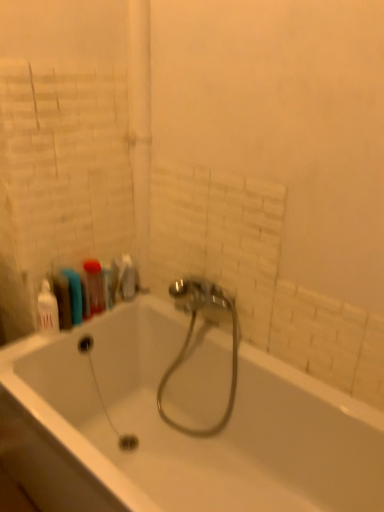
Question: Is white glossy bathtub at center at the left side of translucent plastic toothbrush at upper left, acting as the 2th toiletry starting from the front?

Choices:
 (A) no
 (B) yes

Answer: (A)

Question: Is white glossy bathtub at center far from translucent plastic toothbrush at upper left, which is the 1th toiletry in back-to-front order?

Choices:
 (A) yes
 (B) no

Answer: (B)

Question: Can you see white glossy bathtub at center touching translucent plastic toothbrush at upper left, marked as the 2th toiletry in a left-to-right arrangement?

Choices:
 (A) no
 (B) yes

Answer: (A)

Question: Does white glossy bathtub at center appear on the right side of translucent plastic toothbrush at upper left, acting as the first toiletry starting from the right?

Choices:
 (A) no
 (B) yes

Answer: (B)

Question: From a real-world perspective, is white glossy bathtub at center on translucent plastic toothbrush at upper left, acting as the 2th toiletry starting from the front?

Choices:
 (A) no
 (B) yes

Answer: (A)

Question: Would you say white glossy bathtub at center contains translucent plastic toothbrush at upper left, acting as the 2th toiletry starting from the front?

Choices:
 (A) yes
 (B) no

Answer: (B)

Question: From a real-world perspective, is white glossy bathtub at center beneath white glossy bottle at left, the first toiletry in the left-to-right sequence?

Choices:
 (A) yes
 (B) no

Answer: (A)

Question: Would you consider white glossy bathtub at center to be distant from white glossy bottle at left, the second toiletry from the right?

Choices:
 (A) yes
 (B) no

Answer: (B)

Question: Considering the relative sizes of white glossy bathtub at center and white glossy bottle at left, acting as the first toiletry starting from the front, in the image provided, is white glossy bathtub at center taller than white glossy bottle at left, acting as the first toiletry starting from the front,?

Choices:
 (A) yes
 (B) no

Answer: (A)

Question: Can you confirm if white glossy bathtub at center is shorter than white glossy bottle at left, the second toiletry from the right?

Choices:
 (A) no
 (B) yes

Answer: (A)

Question: Is white glossy bottle at left, the second toiletry from the right, inside white glossy bathtub at center?

Choices:
 (A) no
 (B) yes

Answer: (A)

Question: From the image's perspective, is white glossy bathtub at center located above white glossy bottle at left, the 2th toiletry from the back?

Choices:
 (A) yes
 (B) no

Answer: (B)

Question: Does shiny chrome faucet at center turn towards white glossy bottle at left, acting as the first toiletry starting from the front?

Choices:
 (A) yes
 (B) no

Answer: (B)